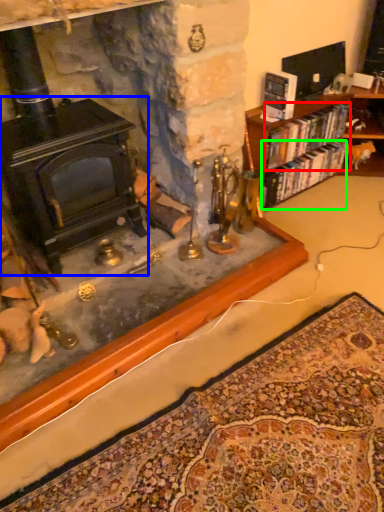
Question: Which object is positioned closest to book (highlighted by a red box)? Select from fireplace (highlighted by a blue box) and book (highlighted by a green box).

Choices:
 (A) fireplace
 (B) book

Answer: (B)